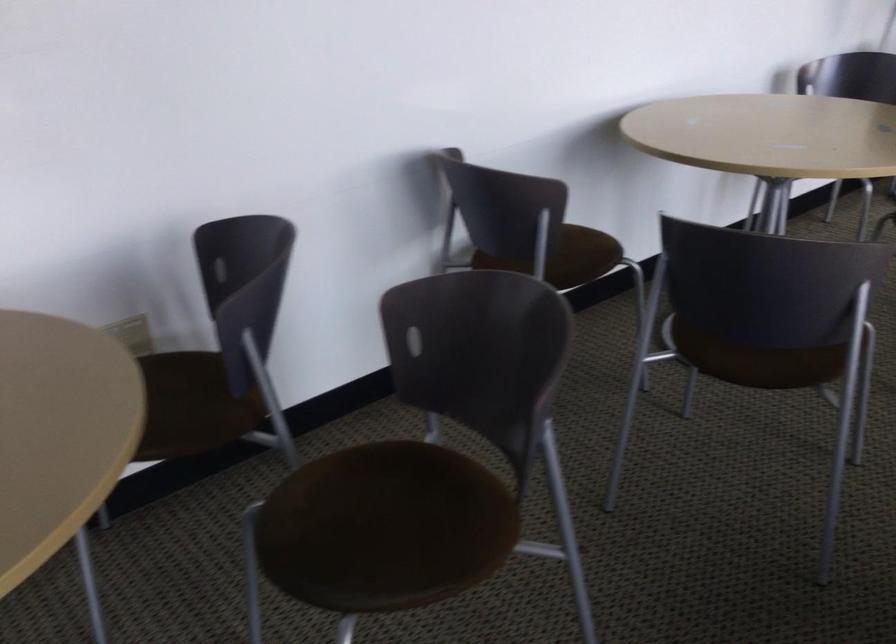
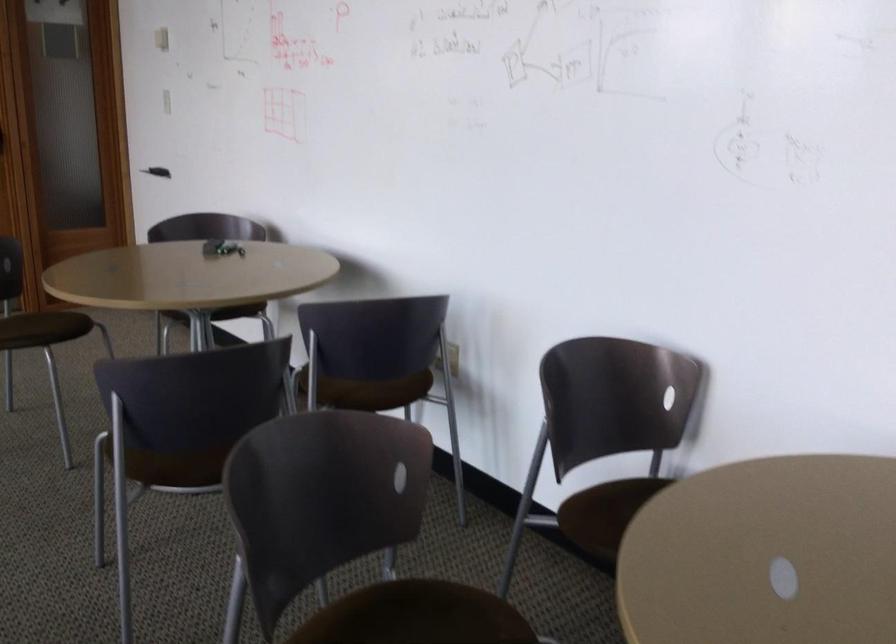
Locate, in the second image, the point that corresponds to pixel 151 341 in the first image.

(452, 359)